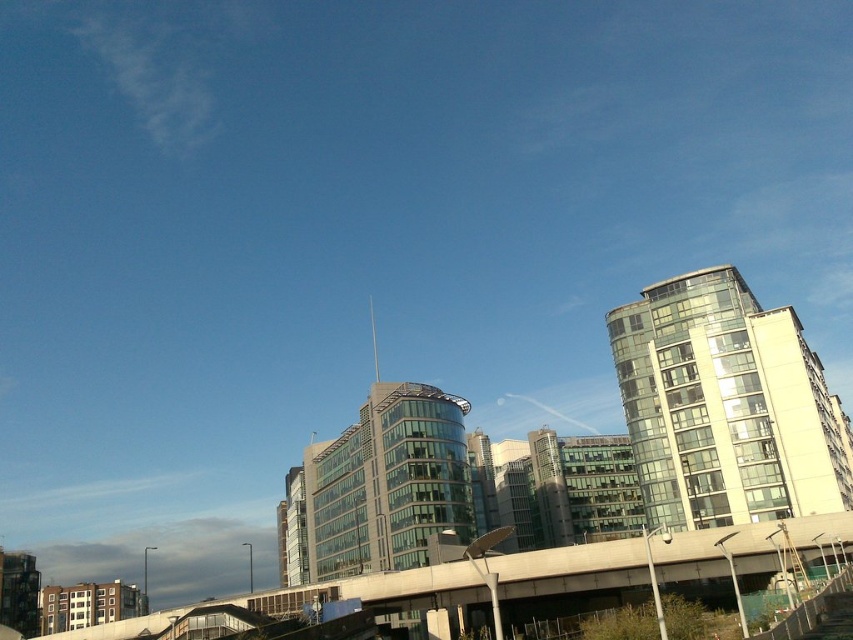
Question: Is glassy white building at upper right to the right of concrete overpass at lower center from the viewer's perspective?

Choices:
 (A) no
 (B) yes

Answer: (B)

Question: Does glassy white building at upper right have a smaller size compared to concrete overpass at lower center?

Choices:
 (A) yes
 (B) no

Answer: (A)

Question: Which object is closer to the camera taking this photo?

Choices:
 (A) glassy white building at upper right
 (B) concrete overpass at lower center

Answer: (B)

Question: Among these points, which one is nearest to the camera?

Choices:
 (A) (444, 586)
 (B) (695, 328)

Answer: (A)

Question: Which of the following is the farthest from the observer?

Choices:
 (A) concrete overpass at lower center
 (B) glassy white building at upper right

Answer: (B)

Question: Does glassy white building at upper right lie in front of concrete overpass at lower center?

Choices:
 (A) yes
 (B) no

Answer: (B)